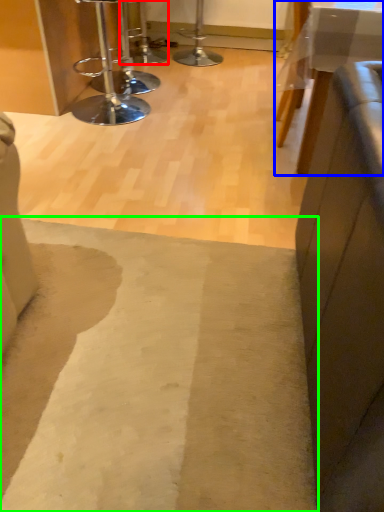
Question: Based on their relative distances, which object is farther from bar stool (highlighted by a red box)? Choose from table (highlighted by a blue box) and mat (highlighted by a green box).

Choices:
 (A) table
 (B) mat

Answer: (B)